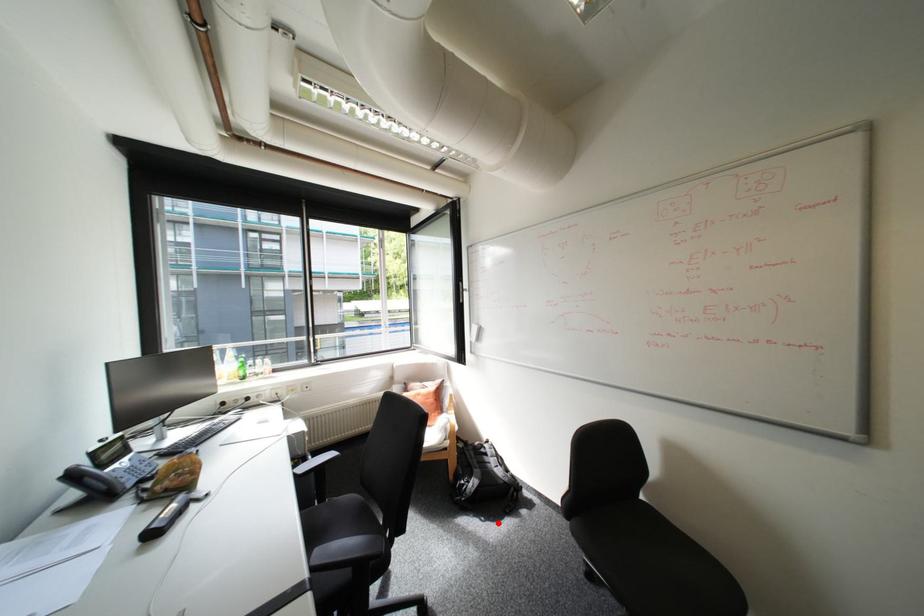
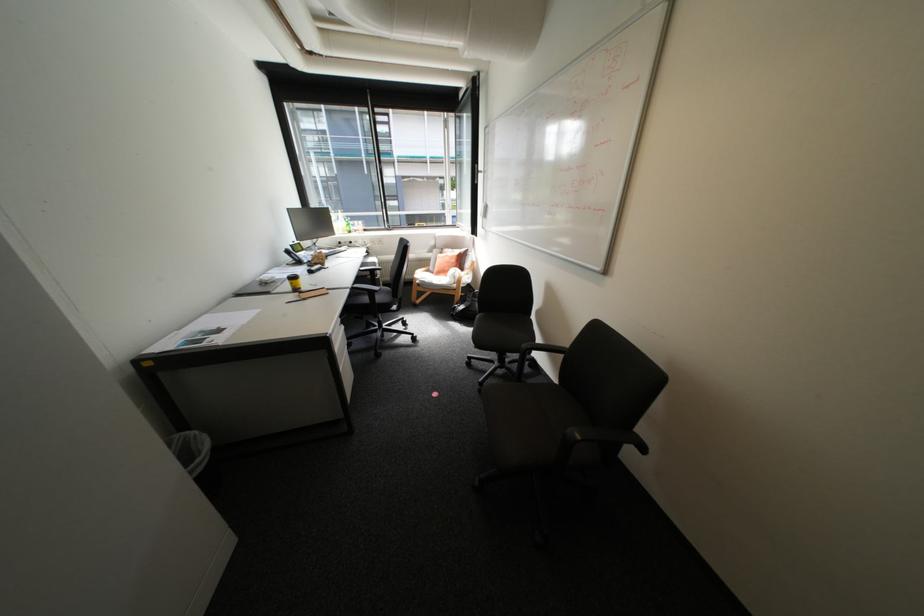
Question: A red point is marked in image1. In image2, is the corresponding 3D point closer to the camera or farther? Reply with the corresponding letter.

Choices:
 (A) The corresponding 3D point is closer.
 (B) The corresponding 3D point is farther.

Answer: (B)